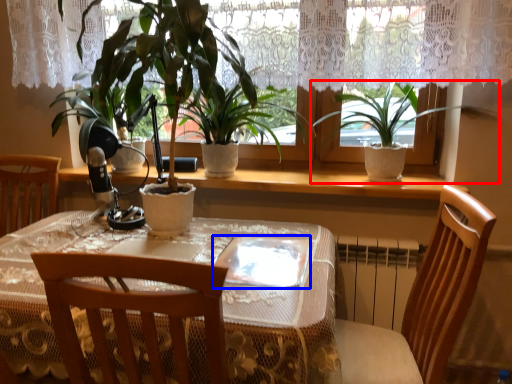
Question: Which object appears closest to the camera in this image, houseplant (highlighted by a red box) or glass plate (highlighted by a blue box)?

Choices:
 (A) houseplant
 (B) glass plate

Answer: (B)